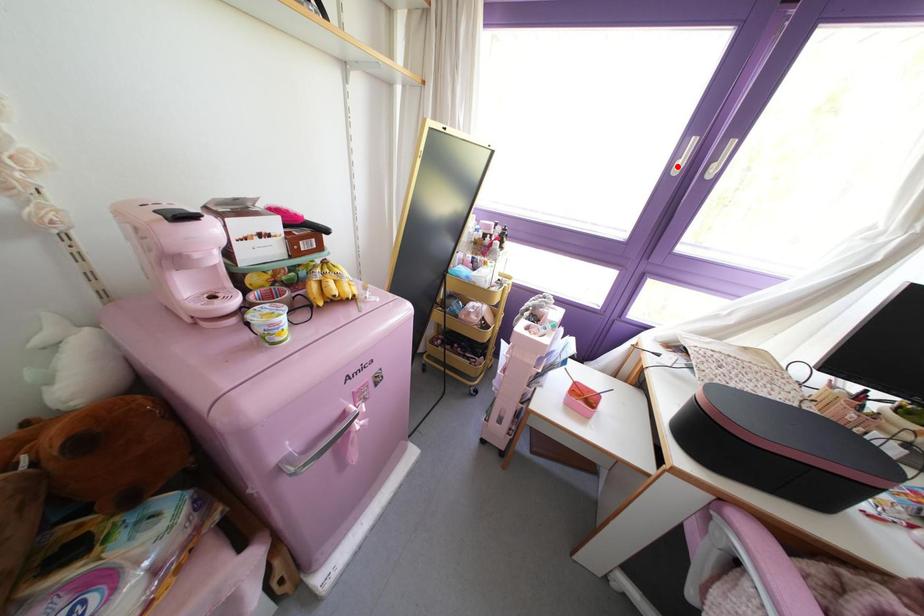
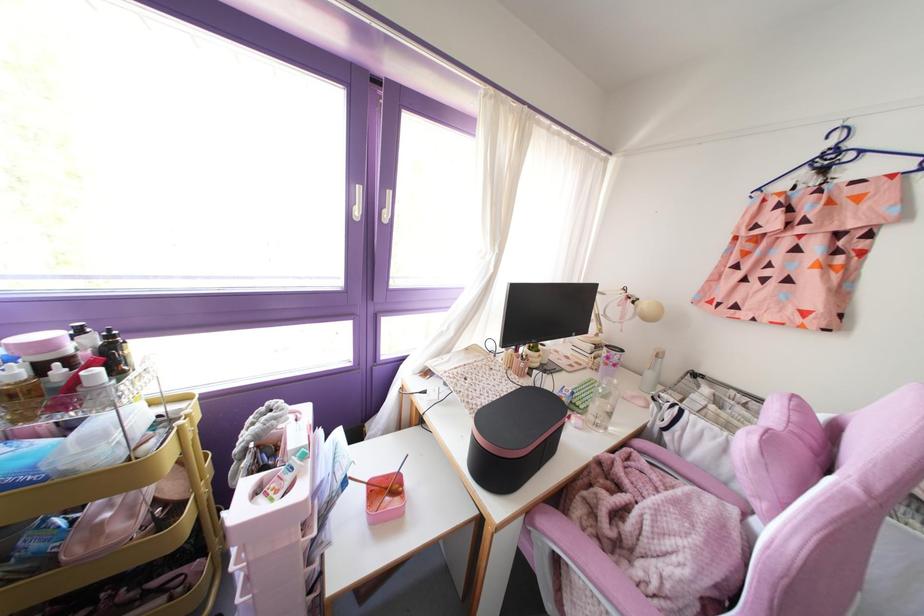
In the second image, find the point that corresponds to the highlighted location in the first image.

(357, 212)